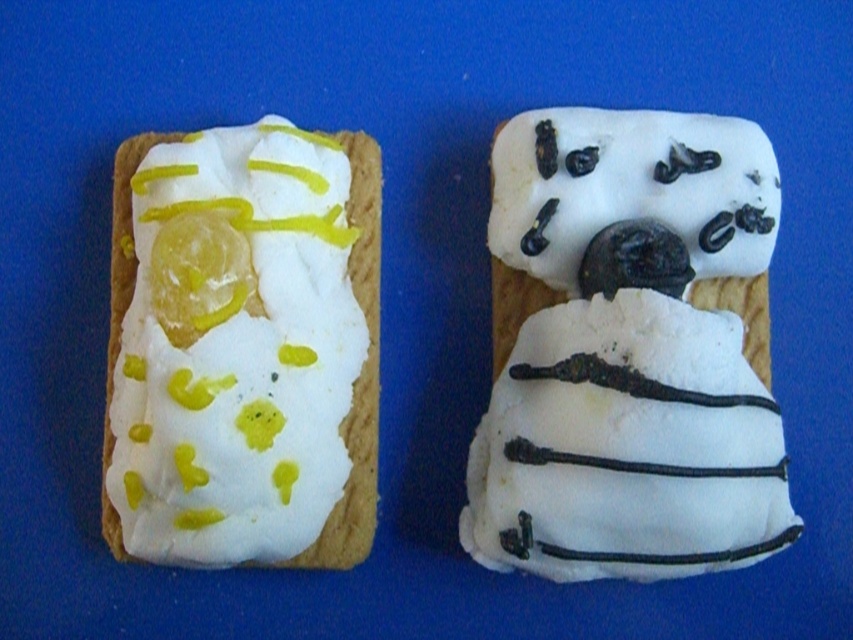
Please describe the location of the white fondant figure at center in the image using coordinates. The coordinate system has the origin at the bottom left corner of the image, with the x and y axes increasing to the right and up respectively. The coordinates are normalized between 0 and 1. Please provide the coordinates as a tuple in the format of two decimal numbers separated by a comma.

The white fondant figure at center is located at coordinates approximately at point [630,349].

You are a baker who wants to stack the white fondant figure at center and the white cream cheese at left on top of each other. Which one should be placed at the bottom to ensure stability?

The white fondant figure at center is much taller than the white cream cheese at left, so placing the shorter white cream cheese at left at the bottom would provide a stable base for the taller one.